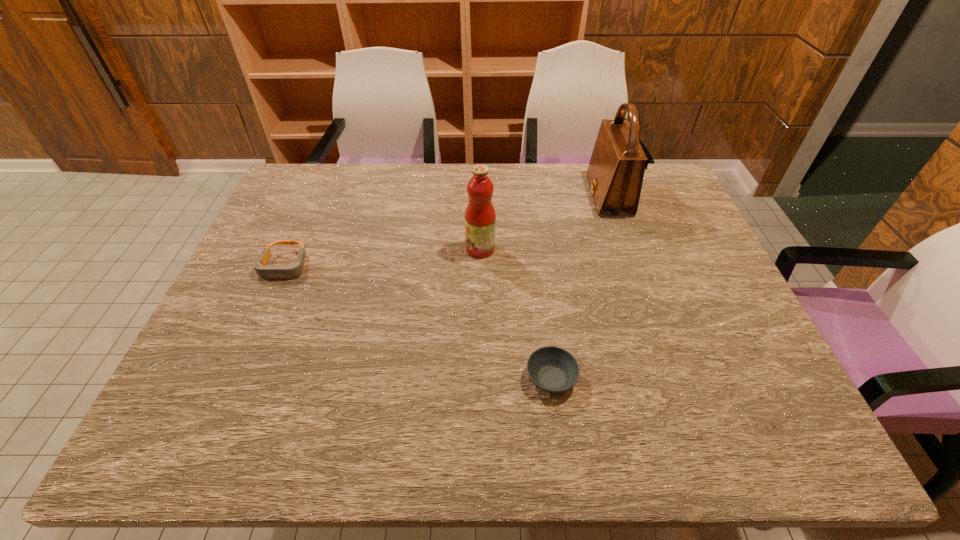
The image size is (960, 540). Find the location of `vacant region at the right edge`. vacant region at the right edge is located at coordinates (704, 321).

Locate an element on the screen. This screenshot has height=540, width=960. vacant space at the near right corner of the desktop is located at coordinates (783, 450).

Image resolution: width=960 pixels, height=540 pixels. I want to click on free spot between the goggles and the second object from right to left, so click(x=418, y=322).

At what (x,y) coordinates should I click in order to perform the action: click on unoccupied area between the goggles and the shoulder bag. Please return your answer as a coordinate pair (x, y). Looking at the image, I should click on (446, 231).

The height and width of the screenshot is (540, 960). Find the location of `vacant area that lies between the fruit juice and the leftmost object`. vacant area that lies between the fruit juice and the leftmost object is located at coordinates (382, 258).

This screenshot has width=960, height=540. I want to click on empty location between the fruit juice and the shoulder bag, so point(544,222).

Locate an element on the screen. This screenshot has width=960, height=540. vacant space in between the nearest object and the leftmost object is located at coordinates (418, 322).

You are a GUI agent. You are given a task and a screenshot of the screen. Output one action in this format:
    pyautogui.click(x=<x>, y=<y>)
    Task: Click on the unoccupied position between the leftmost object and the shoulder bag
    Image resolution: width=960 pixels, height=540 pixels.
    Given the screenshot: What is the action you would take?
    pyautogui.click(x=446, y=231)

Where is `vacant point located between the nearest object and the second tallest object`? vacant point located between the nearest object and the second tallest object is located at coordinates (516, 314).

At what (x,y) coordinates should I click in order to perform the action: click on free space between the third object from right to left and the third object from left to right. Please return your answer as a coordinate pair (x, y). This screenshot has width=960, height=540. Looking at the image, I should click on (516, 314).